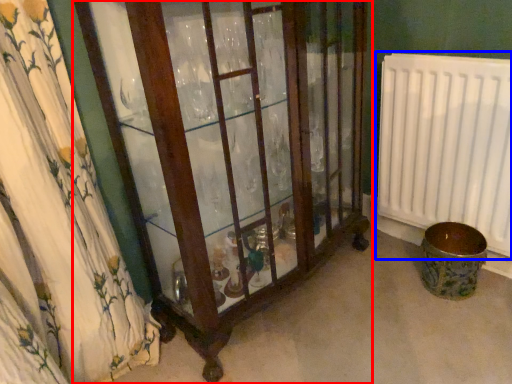
Question: Which of the following is the closest to the observer, furniture (highlighted by a red box) or radiator (highlighted by a blue box)?

Choices:
 (A) furniture
 (B) radiator

Answer: (A)